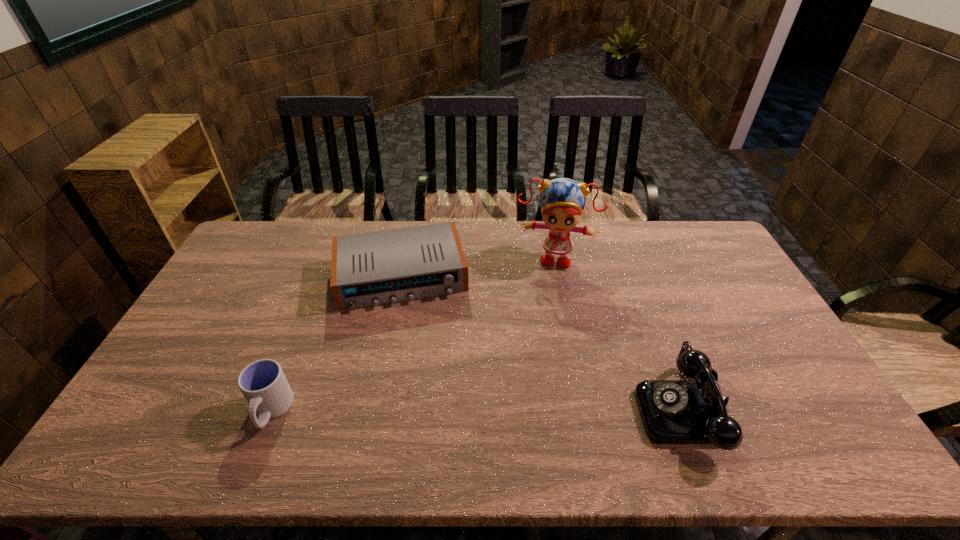
In order to click on cup in this screenshot , I will do `click(263, 383)`.

Where is `telephone`? This screenshot has height=540, width=960. telephone is located at coordinates (694, 411).

This screenshot has height=540, width=960. Identify the location of the shortest object. (373, 268).

At what (x,y) coordinates should I click in order to perform the action: click on the tallest object. Please return your answer as a coordinate pair (x, y). This screenshot has width=960, height=540. Looking at the image, I should click on (561, 200).

Locate an element on the screen. This screenshot has width=960, height=540. vacant space located 0.300m on the dial of the telephone is located at coordinates (521, 410).

This screenshot has width=960, height=540. Find the location of `free space located 0.120m on the dial of the telephone`. free space located 0.120m on the dial of the telephone is located at coordinates (591, 410).

Find the location of `vacant space located 0.270m on the dial of the telephone`. vacant space located 0.270m on the dial of the telephone is located at coordinates (533, 410).

Locate an element on the screen. vacant area situated on the front panel of the shortest object is located at coordinates coord(412,327).

Where is `free space located 0.330m on the front panel of the shortest object`? The image size is (960, 540). free space located 0.330m on the front panel of the shortest object is located at coordinates (422, 403).

Where is `vacant region located on the front panel of the shortest object`? Image resolution: width=960 pixels, height=540 pixels. vacant region located on the front panel of the shortest object is located at coordinates (419, 378).